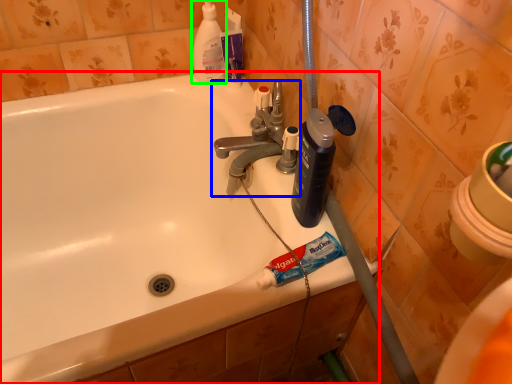
Question: Which is farther away from bathtub (highlighted by a red box)? tap (highlighted by a blue box) or cleaning product (highlighted by a green box)?

Choices:
 (A) tap
 (B) cleaning product

Answer: (B)